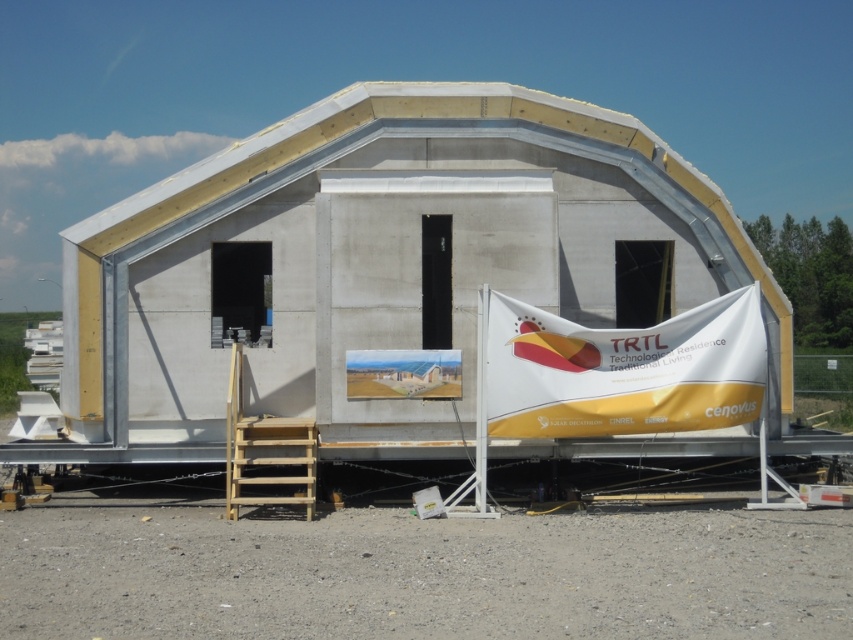
Question: Which point is farther from the camera taking this photo?

Choices:
 (A) (503, 371)
 (B) (665, 189)

Answer: (B)

Question: Observing the image, what is the correct spatial positioning of white concrete hut at center in reference to white/yellow fabric banner at center?

Choices:
 (A) below
 (B) above

Answer: (B)

Question: Is white concrete hut at center wider than white/yellow fabric banner at center?

Choices:
 (A) yes
 (B) no

Answer: (A)

Question: Which object appears closest to the camera in this image?

Choices:
 (A) white/yellow fabric banner at center
 (B) white concrete hut at center

Answer: (A)

Question: Does white concrete hut at center have a smaller size compared to white/yellow fabric banner at center?

Choices:
 (A) yes
 (B) no

Answer: (B)